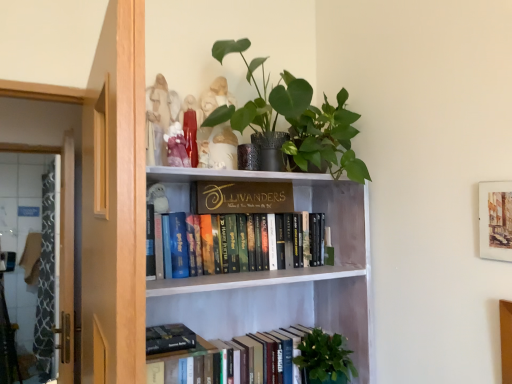
This screenshot has width=512, height=384. Identify the location of vacant region above hardcover book at lower center, placed as the first book when sorted from bottom to top (from a real-world perspective). (260, 337).